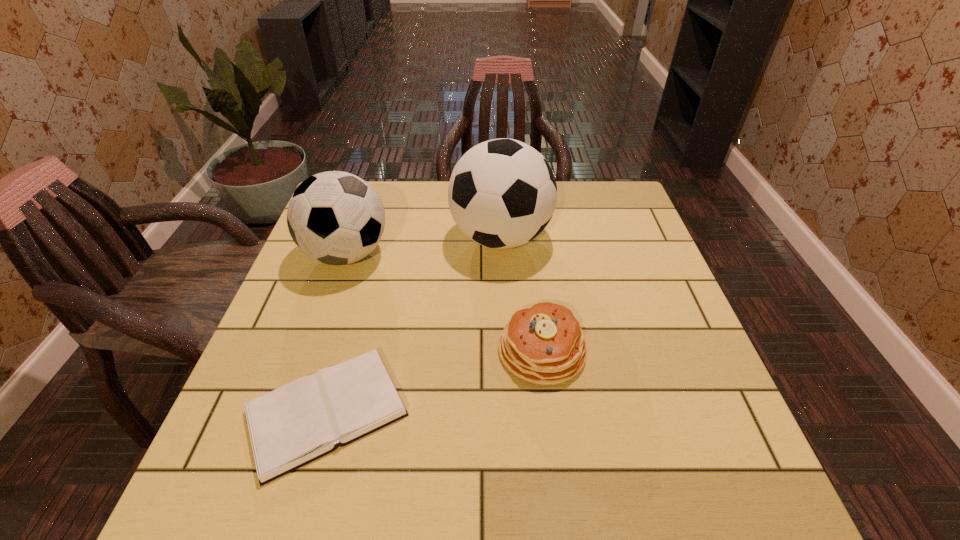
Find the location of a particular element. The width and height of the screenshot is (960, 540). object that stands as the closest to the shortest object is located at coordinates (543, 344).

Where is `the closest object to the shortest object`? the closest object to the shortest object is located at coordinates (543, 344).

Identify the location of vacant space that satisfies the following two spatial constraints: 1. on the back side of the taller soccer ball; 2. on the left side of the shortest object. The height and width of the screenshot is (540, 960). (375, 238).

The width and height of the screenshot is (960, 540). Identify the location of vacant space that satisfies the following two spatial constraints: 1. on the back side of the pancake; 2. on the main logo of the shorter soccer ball. [x=529, y=254].

You are a GUI agent. You are given a task and a screenshot of the screen. Output one action in this format:
    pyautogui.click(x=<x>, y=<y>)
    Task: Click on the vacant point that satisfies the following two spatial constraints: 1. on the front side of the tallest object; 2. on the left side of the pancake
    The height and width of the screenshot is (540, 960).
    Given the screenshot: What is the action you would take?
    pyautogui.click(x=507, y=350)

At what (x,y) coordinates should I click in order to perform the action: click on vacant space that satisfies the following two spatial constraints: 1. on the main logo of the second tallest object; 2. on the back side of the hardback book. Please return your answer as a coordinate pair (x, y). This screenshot has width=960, height=540. Looking at the image, I should click on (293, 412).

At what (x,y) coordinates should I click in order to perform the action: click on vacant space that satisfies the following two spatial constraints: 1. on the main logo of the shorter soccer ball; 2. on the right side of the shortest object. Please return your answer as a coordinate pair (x, y). Looking at the image, I should click on (293, 412).

Where is `free space that satisfies the following two spatial constraints: 1. on the main logo of the shorter soccer ball; 2. on the left side of the shortest object`? The width and height of the screenshot is (960, 540). free space that satisfies the following two spatial constraints: 1. on the main logo of the shorter soccer ball; 2. on the left side of the shortest object is located at coordinates (293, 412).

Where is `free space that satisfies the following two spatial constraints: 1. on the back side of the third tallest object; 2. on the main logo of the third shortest object`? free space that satisfies the following two spatial constraints: 1. on the back side of the third tallest object; 2. on the main logo of the third shortest object is located at coordinates (529, 254).